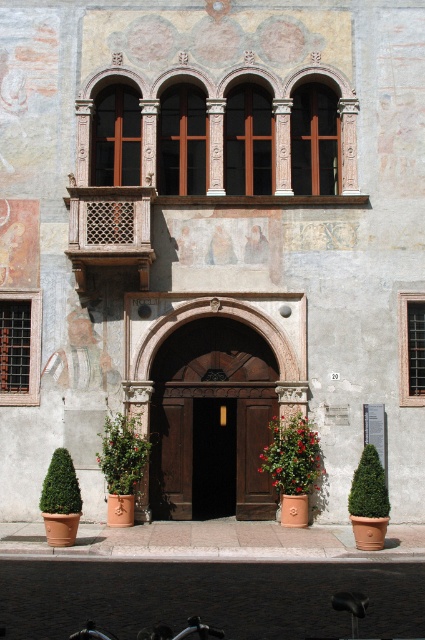
Measure the distance from dark wood door at center to green leafy bush at lower right.

dark wood door at center and green leafy bush at lower right are 3.63 meters apart.

From the picture: Can you confirm if dark wood door at center is bigger than green leafy bush at lower right?

Yes, dark wood door at center is bigger than green leafy bush at lower right.

Measure the distance between point (238, 500) and camera.

They are 64.56 feet apart.

Locate an element on the screen. This screenshot has height=640, width=425. dark wood door at center is located at coordinates (209, 451).

Does dark wood door at center have a larger size compared to black wooden door at center?

Yes.

Who is positioned more to the left, dark wood door at center or black wooden door at center?

black wooden door at center is more to the left.

Locate an element on the screen. dark wood door at center is located at coordinates (209, 451).

Identify the location of dark wood door at center. This screenshot has height=640, width=425. (209, 451).

Can you confirm if red matte flower pot at lower center is wider than green leafy plant at lower center?

No.

Is red matte flower pot at lower center positioned at the back of green leafy plant at lower center?

Yes, red matte flower pot at lower center is further from the viewer.

This screenshot has width=425, height=640. What are the coordinates of `red matte flower pot at lower center` in the screenshot? It's located at (291, 456).